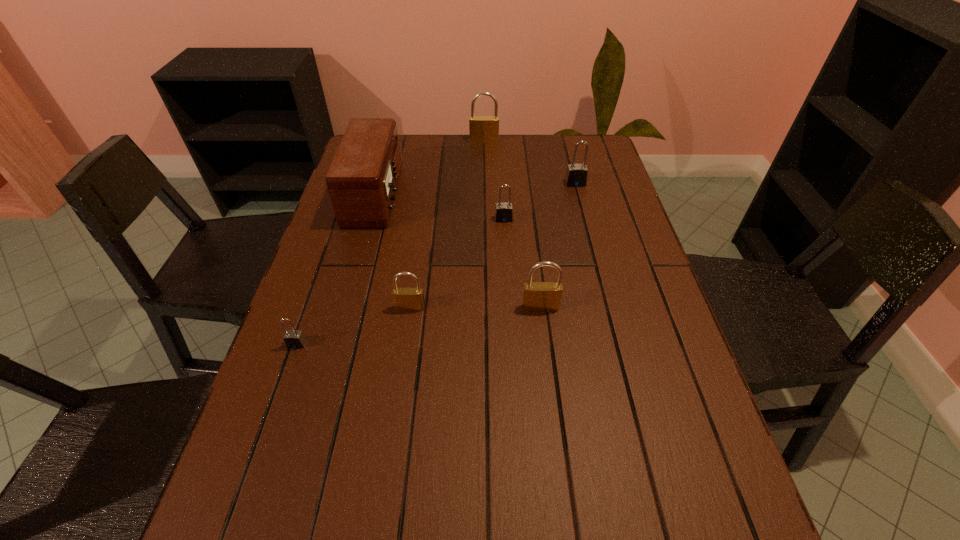
Where is `vacant space that's between the radio receiver and the sixth object from left to right`? vacant space that's between the radio receiver and the sixth object from left to right is located at coordinates (458, 251).

Find the location of a particular element. The height and width of the screenshot is (540, 960). free space between the fifth nearest padlock and the radio receiver is located at coordinates (476, 190).

Identify the location of unoccupied area between the second object from right to left and the second brass padlock from left to right. This screenshot has width=960, height=540. (513, 224).

You are a GUI agent. You are given a task and a screenshot of the screen. Output one action in this format:
    pyautogui.click(x=<x>, y=<y>)
    Task: Click on the vacant point located between the farthest gray padlock and the farthest brass padlock
    This screenshot has height=540, width=960.
    Given the screenshot: What is the action you would take?
    pyautogui.click(x=530, y=163)

This screenshot has width=960, height=540. In order to click on vacant space in between the radio receiver and the leftmost padlock in this screenshot , I will do `click(337, 269)`.

Identify the location of free point between the fourth nearest padlock and the third object from left to right. The width and height of the screenshot is (960, 540). (457, 264).

Where is `vacant point located between the radio receiver and the fifth padlock from left to right`? Image resolution: width=960 pixels, height=540 pixels. vacant point located between the radio receiver and the fifth padlock from left to right is located at coordinates (458, 251).

Identify the location of object that stands as the sixth closest to the third object from left to right. (483, 129).

The height and width of the screenshot is (540, 960). I want to click on object that stands as the second closest to the second padlock from right to left, so click(x=504, y=211).

Where is `the fourth closest padlock to the second biggest gray padlock`? the fourth closest padlock to the second biggest gray padlock is located at coordinates (483, 129).